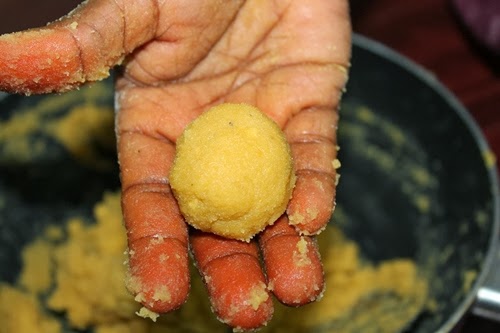
This screenshot has width=500, height=333. Find the location of `silver edge of pot`. silver edge of pot is located at coordinates (453, 98).